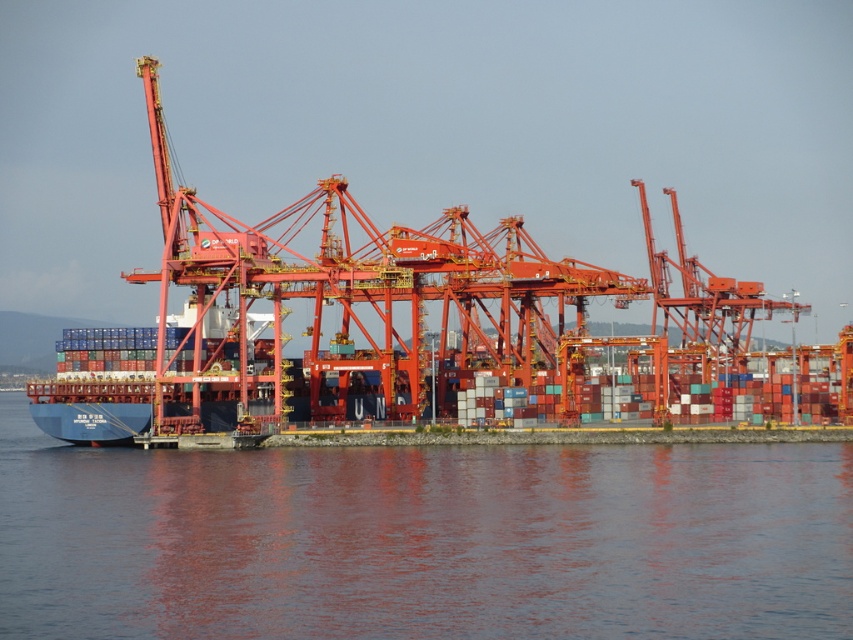
You are a port engineer assessing the layout of the port. You need to determine if there is enough space between the transparent water at lower center and the metallic orange crane at center to safely maneuver a large cargo truck. Can you confirm if the space is sufficient?

The transparent water at lower center has a width less than the metallic orange crane at center, so the space between them may be too narrow for a large cargo truck to maneuver safely. It is recommended to choose a wider path or adjust the truck route.

You are a crane operator who needs to lower a container into the water. Considering the size of the transparent water at lower center and the metallic orange crane at center, can you safely lower the container into the water without hitting the crane?

The transparent water at lower center has a smaller size compared to the metallic orange crane at center, so lowering the container into the water might risk collision with the crane. Ensure there is enough space before proceeding.

You are a port engineer inspecting the dock area. You need to determine the coordinates of the transparent water at lower center. What are its coordinates?

The coordinates of the transparent water at lower center are at point [422,540].